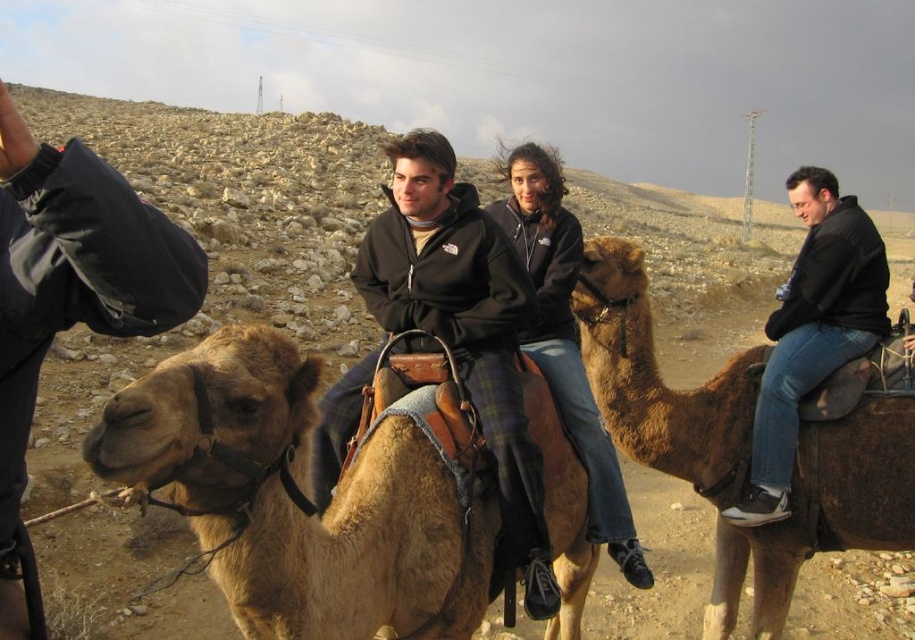
You are a photographer standing in the desert scene. You want to take a photo that includes both the brown fuzzy camel at right and the matte black jacket at center. Based on their positions, which object should you adjust your camera angle to focus on first to ensure both are in the frame?

The brown fuzzy camel at right is to the right of the matte black jacket at center. To include both in the frame, you should first focus on the matte black jacket at center, then adjust your angle to include the camel to its right.

You are a photographer positioned in the desert scene and want to take a photo of both the black leather jacket at center and the matte black jacket at center. Which jacket will appear closer to the camera in the photo?

The black leather jacket at center will appear closer to the camera in the photo because it is further to the viewer than the matte black jacket at center.

You are a photographer trying to capture a clear photo of the black leather jacket at center. However, the brown fuzzy camel at right is blocking your view. Based on their positions, can you move to the left or right to get an unobstructed shot of the jacket?

The brown fuzzy camel at right is in front of the black leather jacket at center, so moving to the left might allow you to position yourself around the camel to capture the jacket without obstruction.